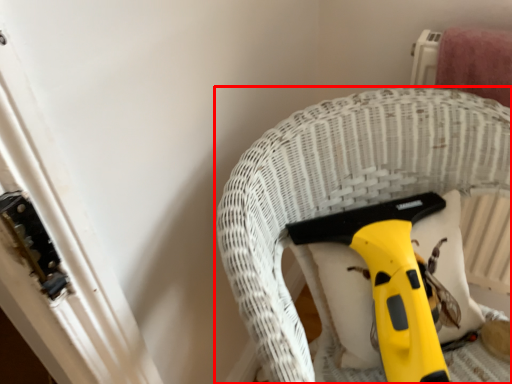
Question: From the image's perspective, considering the relative positions of furniture (annotated by the red box) and tool in the image provided, where is furniture (annotated by the red box) located with respect to the staircase?

Choices:
 (A) below
 (B) above

Answer: (A)